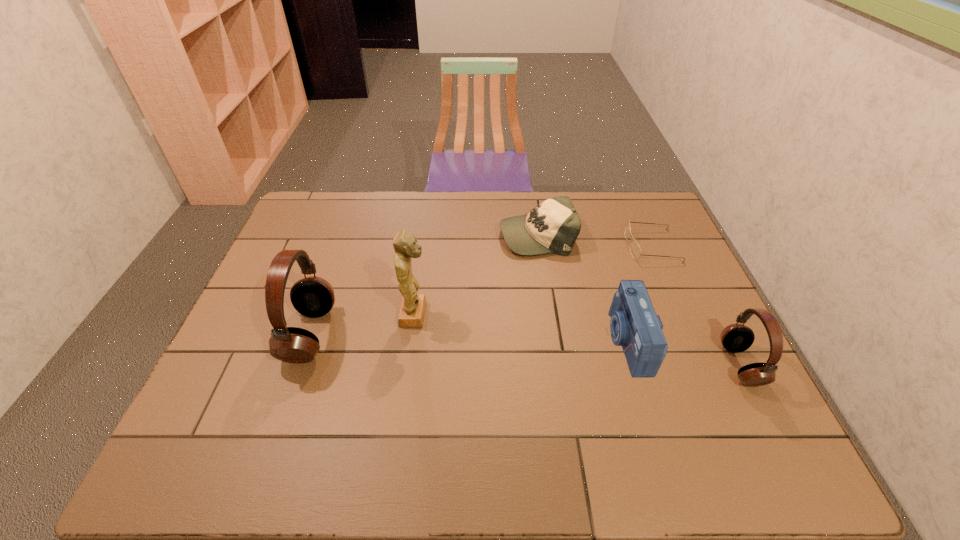
Please point a spot to place another headset for symmetrical spacing. Please provide its 2D coordinates. Your answer should be formatted as a tuple, i.e. [(x, y)], where the tuple contains the x and y coordinates of a point satisfying the conditions above.

[(518, 349)]